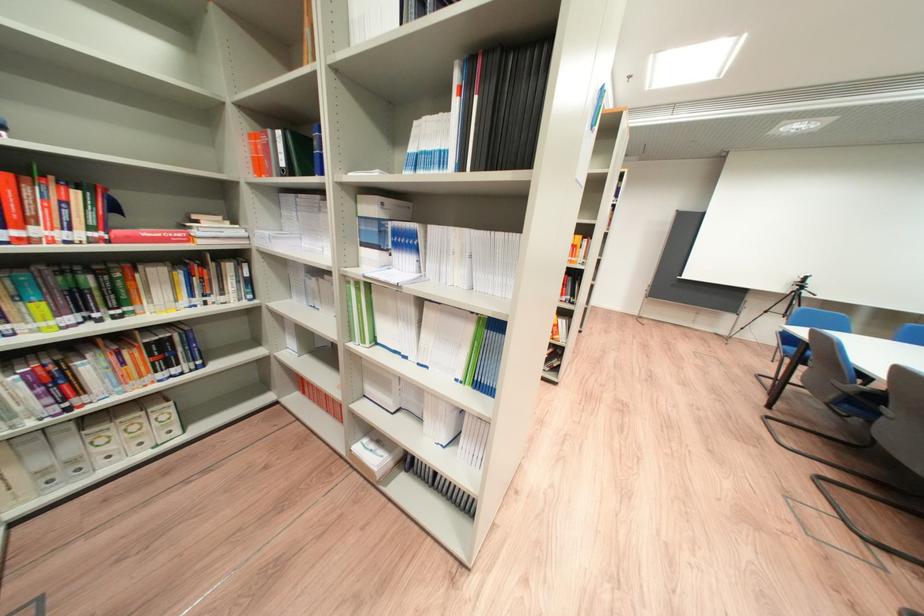
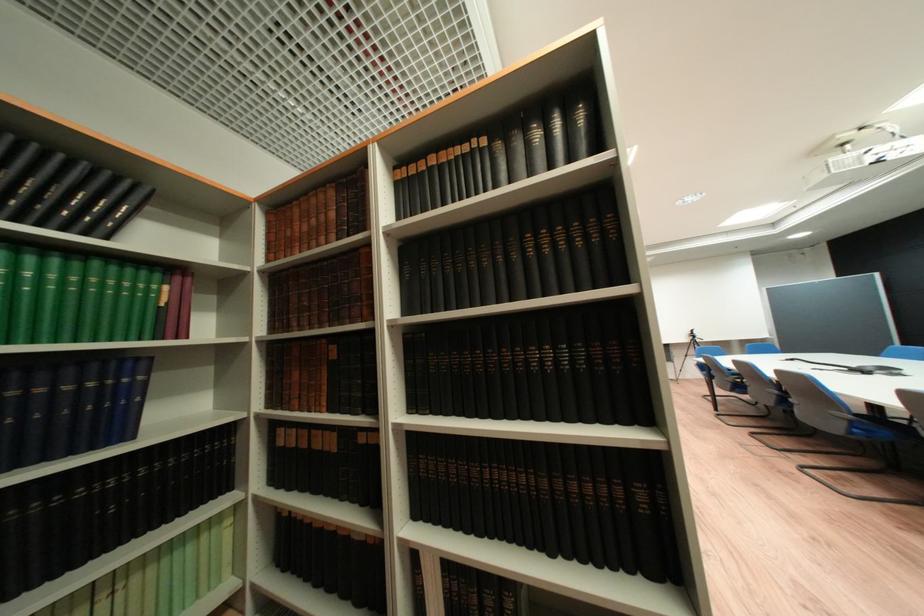
In a continuous first-person perspective shot, in which direction is the camera moving?

The cameraman moved toward left, backward.